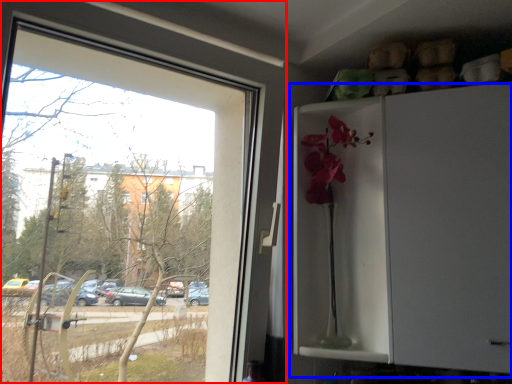
Question: Which object is further to the camera taking this photo, window (highlighted by a red box) or fridge (highlighted by a blue box)?

Choices:
 (A) window
 (B) fridge

Answer: (B)